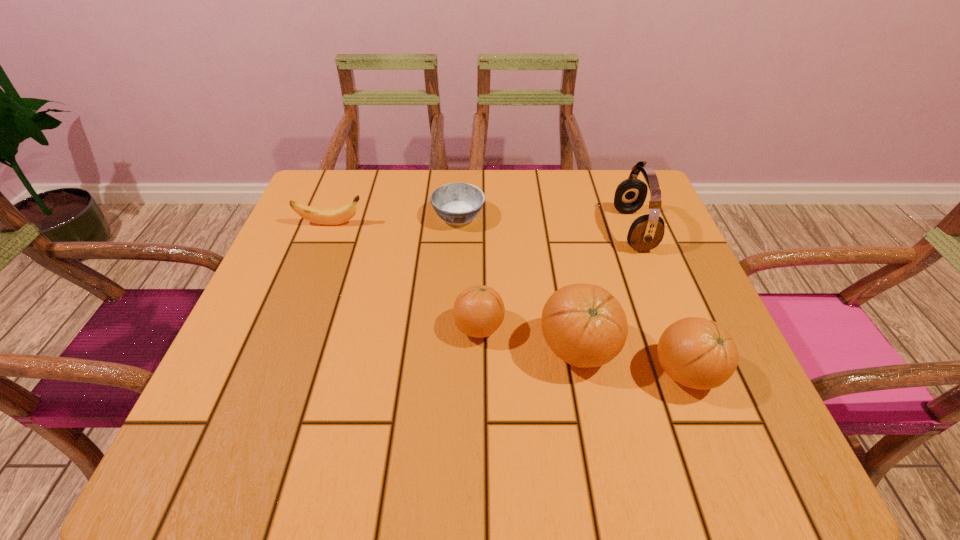
The height and width of the screenshot is (540, 960). In order to click on free space that satisfies the following two spatial constraints: 1. on the back side of the leftmost orange; 2. at the stem of the leftmost object in this screenshot , I will do `click(479, 224)`.

Locate an element on the screen. The height and width of the screenshot is (540, 960). vacant area that satisfies the following two spatial constraints: 1. at the stem of the leftmost object; 2. on the left side of the second orange from right to left is located at coordinates (283, 349).